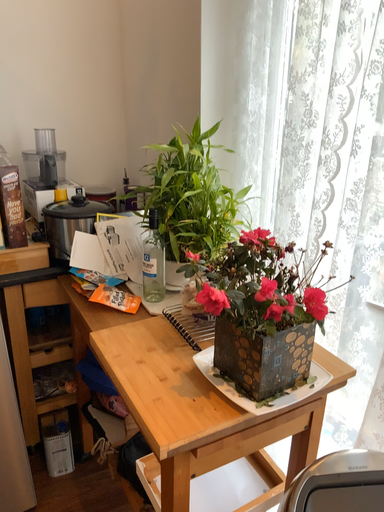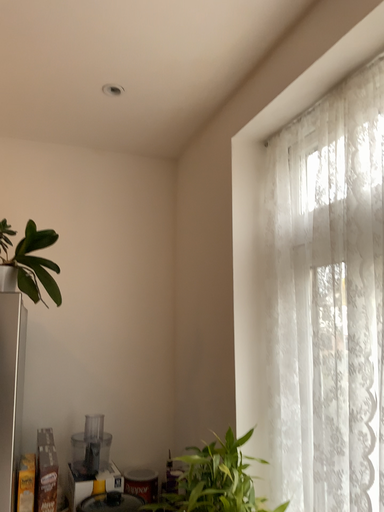
Question: How did the camera likely rotate when shooting the video?

Choices:
 (A) rotated downward
 (B) rotated upward

Answer: (B)